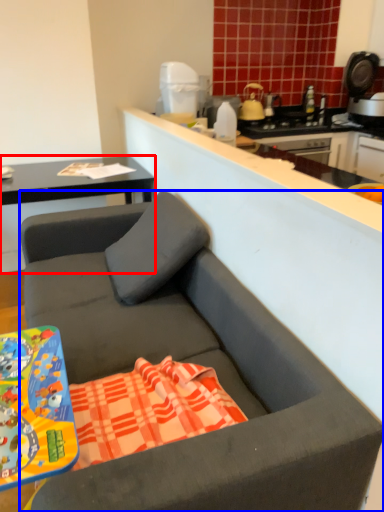
Question: Among these objects, which one is farthest to the camera, cabinetry (highlighted by a red box) or studio couch (highlighted by a blue box)?

Choices:
 (A) cabinetry
 (B) studio couch

Answer: (A)